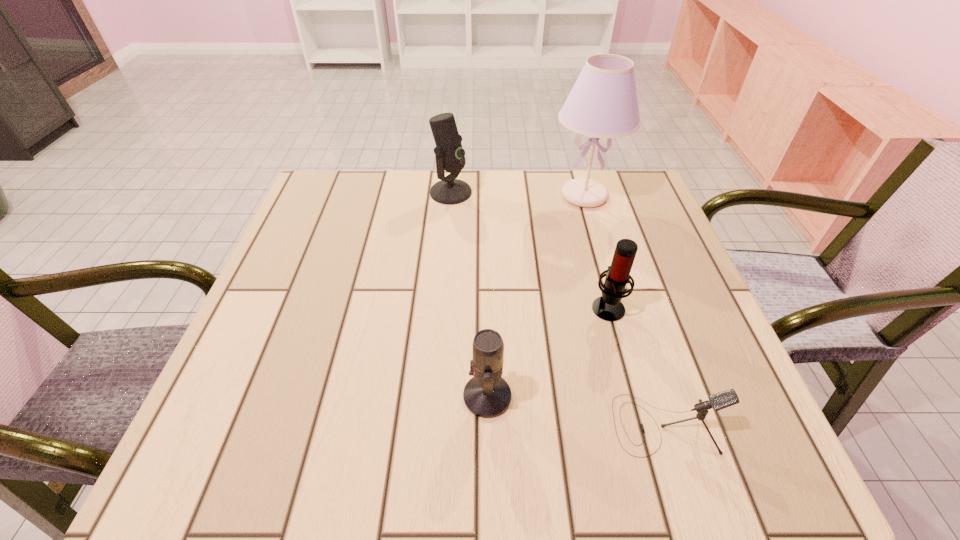
At what (x,y) coordinates should I click in order to perform the action: click on vacant space at the right edge of the desktop. Please return your answer as a coordinate pair (x, y). Image resolution: width=960 pixels, height=540 pixels. Looking at the image, I should click on click(x=675, y=259).

Find the location of a particular element. vacant space at the far left corner of the desktop is located at coordinates (322, 181).

Locate an element on the screen. Image resolution: width=960 pixels, height=540 pixels. free space at the near left corner is located at coordinates (259, 462).

In the image, there is a desktop. Identify the location of free region at the far right corner. The width and height of the screenshot is (960, 540). (621, 188).

Where is `vacant space at the near right corner of the desktop`? Image resolution: width=960 pixels, height=540 pixels. vacant space at the near right corner of the desktop is located at coordinates (742, 424).

Locate an element on the screen. The image size is (960, 540). free spot between the lampshade and the second farthest microphone is located at coordinates (596, 251).

This screenshot has height=540, width=960. In order to click on empty space between the tallest object and the third nearest microphone in this screenshot , I will do `click(596, 251)`.

The image size is (960, 540). I want to click on free space that is in between the fourth shortest object and the tallest object, so click(517, 194).

Locate which object ranks in proximity to the third nearest object. Please provide its 2D coordinates. Your answer should be formatted as a tuple, i.e. [(x, y)], where the tuple contains the x and y coordinates of a point satisfying the conditions above.

[(721, 400)]

Identify the location of object that stands as the second closest to the third farthest object. (487, 395).